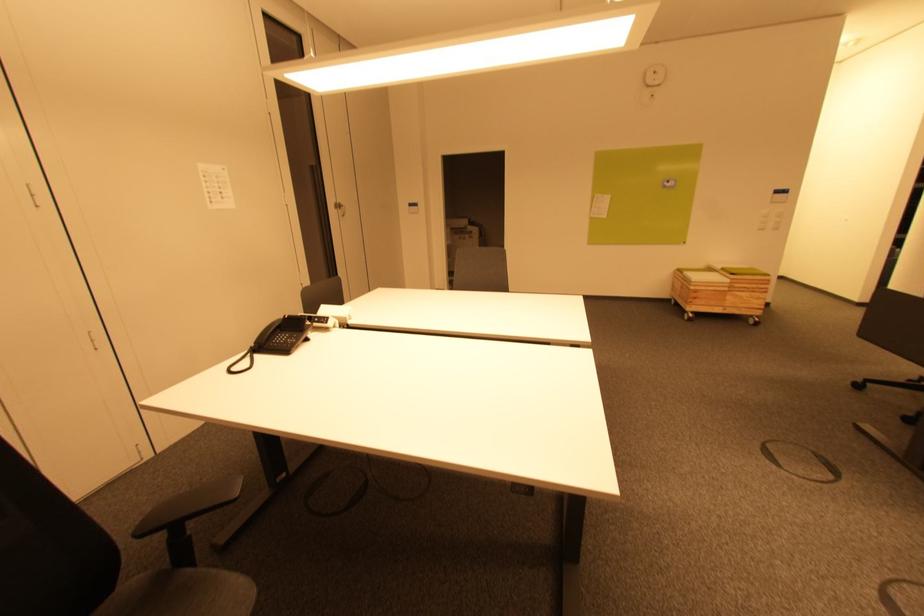
The location [721,291] corresponds to which object?

This point indicates the wooden storage crate.